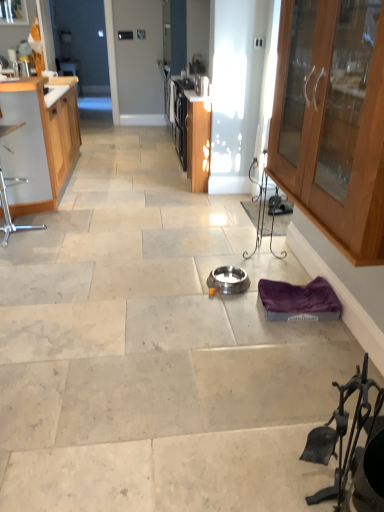
Image resolution: width=384 pixels, height=512 pixels. Identify the location of spots to the right of metallic silver chair at left, positioned as the first chair in back-to-front order. (62, 233).